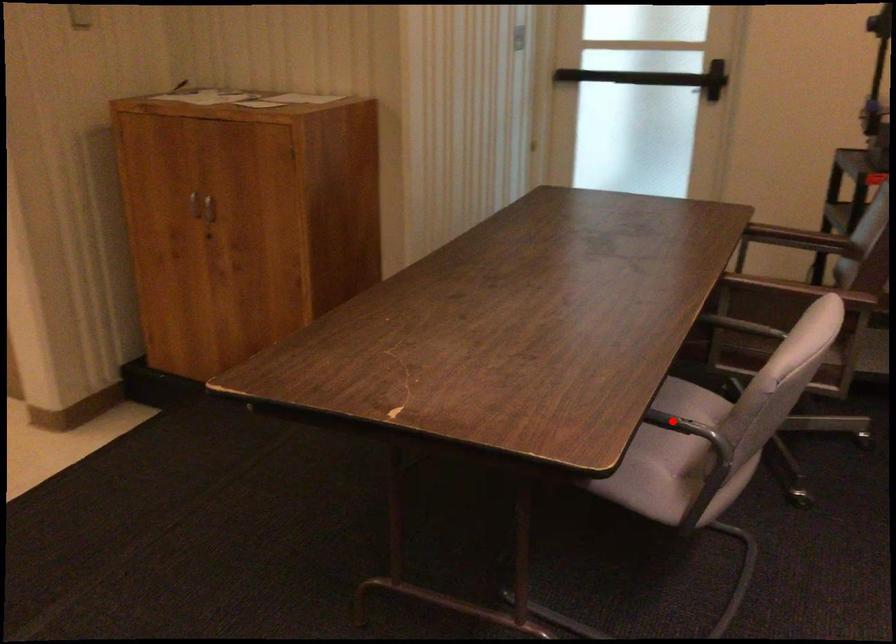
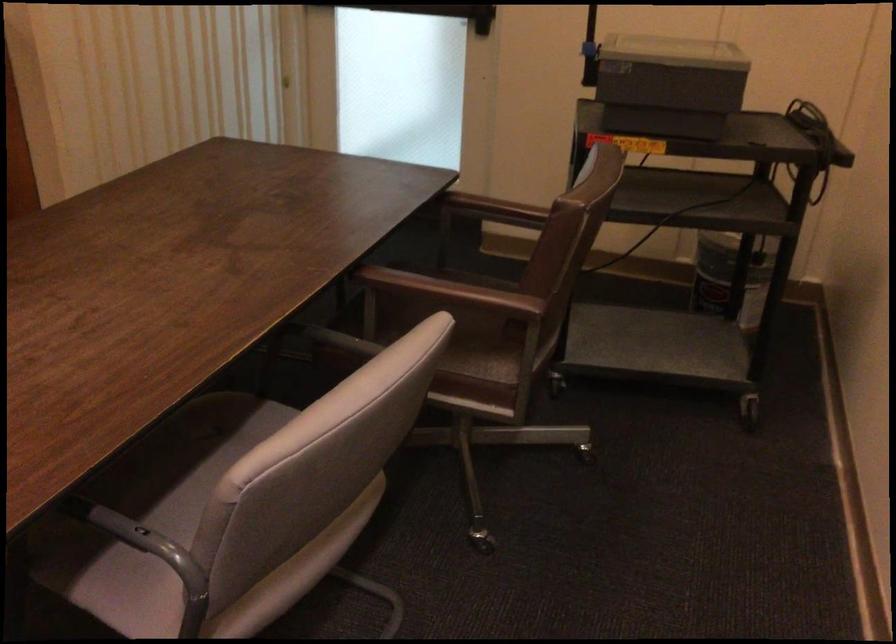
Question: I am providing you with two images of the same scene from different viewpoints. A red point is marked on the first image. Is the red point's position out of view in image 2?

Choices:
 (A) Yes
 (B) No

Answer: (B)